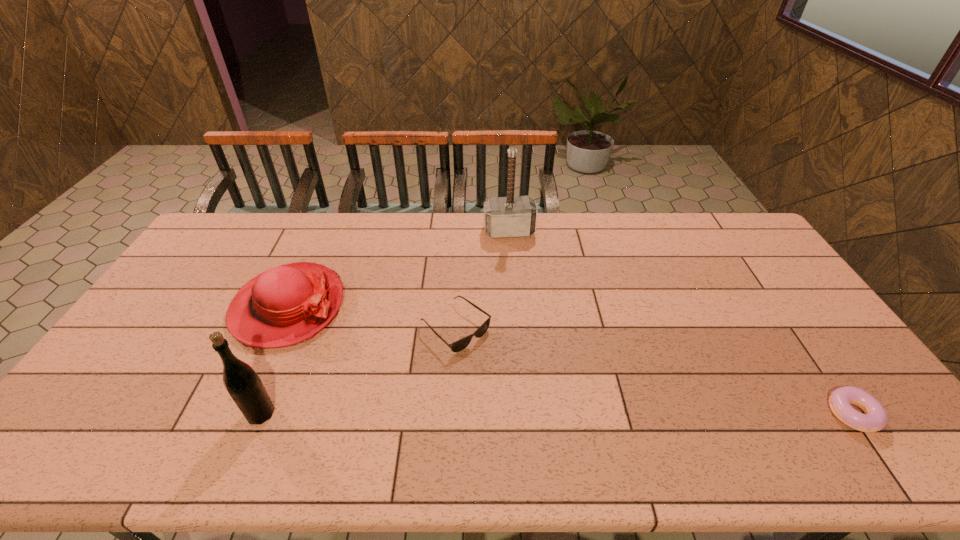
Identify the location of beer bottle. The width and height of the screenshot is (960, 540). (245, 387).

What are the coordinates of `doughnut` in the screenshot? It's located at (875, 418).

Locate an element on the screen. the farthest object is located at coordinates 510,216.

Find the location of a particular element. the third shortest object is located at coordinates (283, 306).

The width and height of the screenshot is (960, 540). I want to click on sunglasses, so click(x=461, y=344).

Image resolution: width=960 pixels, height=540 pixels. Identify the location of free location located on the back of the beer bottle. (307, 301).

Locate an element on the screen. The width and height of the screenshot is (960, 540). free space located 0.120m on the left of the doughnut is located at coordinates (780, 414).

The width and height of the screenshot is (960, 540). Find the location of `free space located 0.050m for striking with the head of the hammer`. free space located 0.050m for striking with the head of the hammer is located at coordinates tap(514, 249).

I want to click on free location located for striking with the head of the hammer, so click(523, 296).

The height and width of the screenshot is (540, 960). I want to click on vacant space positioned 0.320m for striking with the head of the hammer, so click(x=524, y=303).